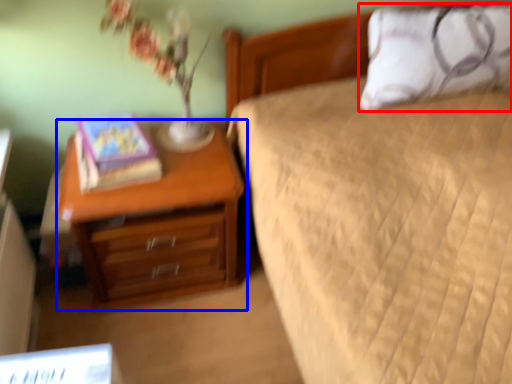
Question: Which of the following is the farthest to the observer, pillow (highlighted by a red box) or nightstand (highlighted by a blue box)?

Choices:
 (A) pillow
 (B) nightstand

Answer: (A)